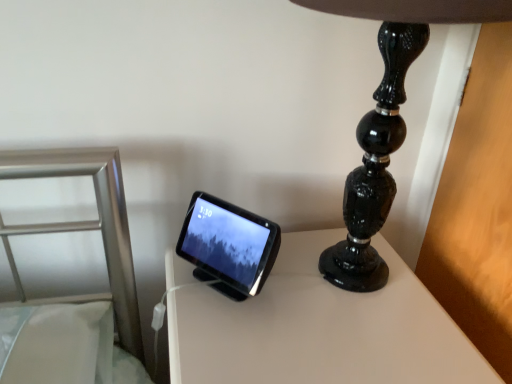
Identify the location of free spot below black glossy lamp at upper right (from a real-world perspective). The height and width of the screenshot is (384, 512). (349, 281).